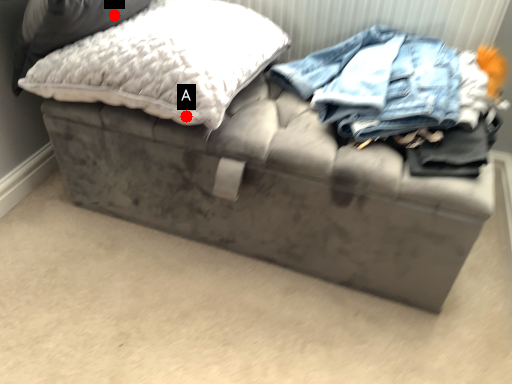
Question: Two points are circled on the image, labeled by A and B beside each circle. Which point is closer to the camera?

Choices:
 (A) A is closer
 (B) B is closer

Answer: (A)